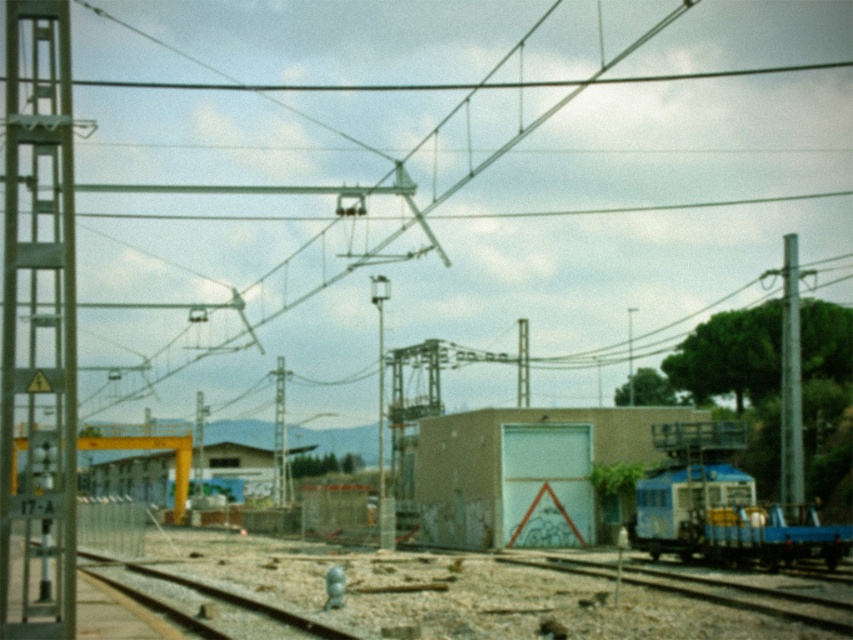
Question: Does smooth metal rail at center appear on the left side of metallic pole at center?

Choices:
 (A) yes
 (B) no

Answer: (A)

Question: Does blue metallic train at lower right appear under metallic pole at right?

Choices:
 (A) yes
 (B) no

Answer: (A)

Question: Which point is closer to the camera?

Choices:
 (A) metallic pole at center
 (B) light brown concrete building at center

Answer: (A)

Question: Can you confirm if blue metallic train at lower right is bigger than smooth metal rail at center?

Choices:
 (A) yes
 (B) no

Answer: (B)

Question: Among these points, which one is nearest to the camera?

Choices:
 (A) (653, 483)
 (B) (672, 412)
 (C) (381, 298)

Answer: (A)

Question: Which point is farther from the camera taking this photo?

Choices:
 (A) (792, 412)
 (B) (379, 426)
 (C) (524, 513)
 (D) (764, 550)

Answer: (B)